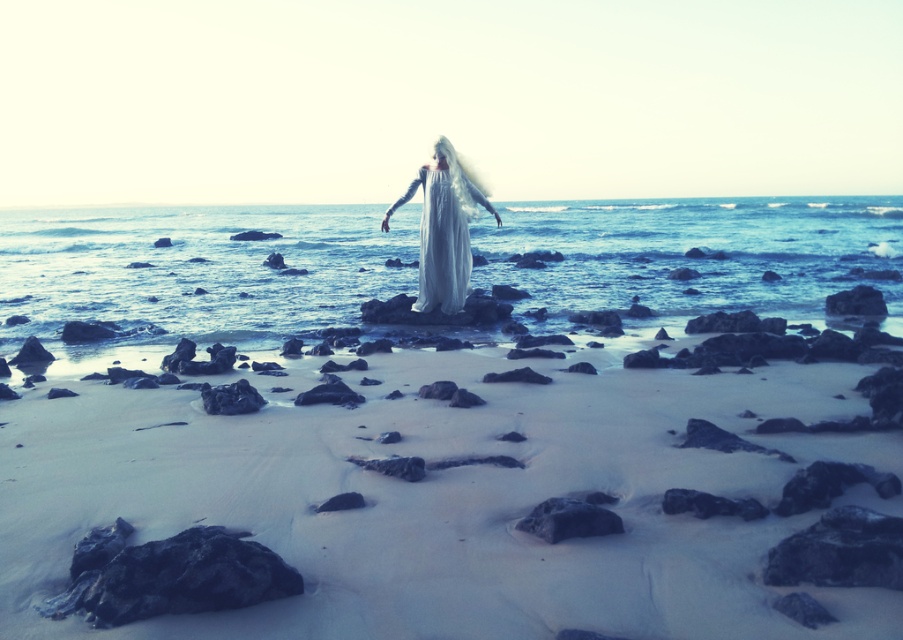
What do you see at coordinates (459, 500) in the screenshot?
I see `white sand at center` at bounding box center [459, 500].

Between white sand at center and translucent white water at center, which one appears on the left side from the viewer's perspective?

white sand at center is more to the left.

Between point (664, 412) and point (529, 289), which one is positioned in front?

Point (664, 412) is more forward.

Locate an element on the screen. Image resolution: width=903 pixels, height=640 pixels. white sand at center is located at coordinates (459, 500).

Measure the distance between point (433, 292) and camera.

→ Point (433, 292) is 11.05 meters from camera.

Can you confirm if white silk dress at center is positioned to the right of smooth gray rock at center?

In fact, white silk dress at center is to the left of smooth gray rock at center.

Which is behind, point (464, 273) or point (535, 522)?

Point (464, 273)

At what (x,y) coordinates should I click in order to perform the action: click on white silk dress at center. Please return your answer as a coordinate pair (x, y). This screenshot has height=640, width=903. Looking at the image, I should click on (443, 228).

Which is above, translucent white water at center or white silk dress at center?

translucent white water at center is above.

Is point (725, 291) behind point (422, 225)?

That is True.

Locate an element on the screen. translucent white water at center is located at coordinates (200, 268).